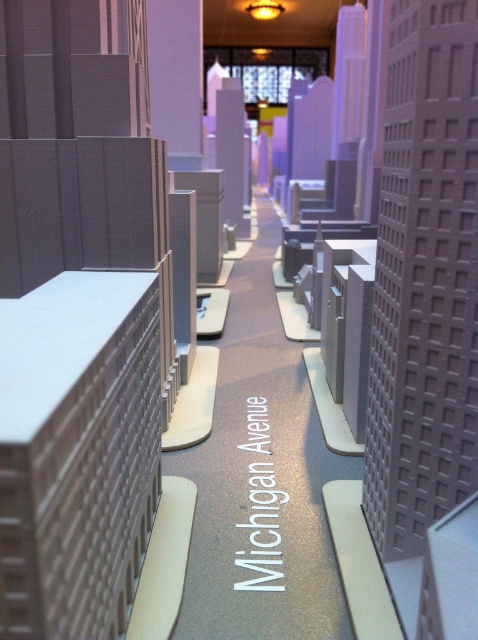
Looking at this image, can you confirm if brown textured building at center-right is bigger than matte gray pillar at center?

Indeed, brown textured building at center-right has a larger size compared to matte gray pillar at center.

Between brown textured building at center-right and matte gray pillar at center, which one appears on the left side from the viewer's perspective?

From the viewer's perspective, matte gray pillar at center appears more on the left side.

Is point (364, 486) closer to camera compared to point (176, 252)?

That is True.

The image size is (478, 640). I want to click on brown textured building at center-right, so click(x=424, y=280).

Does brown textured building at center-right have a greater width compared to purple matte building at center?

No.

Can you confirm if brown textured building at center-right is positioned below purple matte building at center?

Indeed, brown textured building at center-right is positioned under purple matte building at center.

The width and height of the screenshot is (478, 640). Describe the element at coordinates (424, 280) in the screenshot. I see `brown textured building at center-right` at that location.

Identify the location of brown textured building at center-right. 424,280.

Is point (173, 321) more distant than point (220, 106)?

That is False.

Between point (195, 212) and point (234, 202), which one is positioned in front?

Point (195, 212) is more forward.

Where is `matte gray pillar at center`? Image resolution: width=478 pixels, height=640 pixels. matte gray pillar at center is located at coordinates (183, 275).

Find the location of a particular element. matte gray pillar at center is located at coordinates [183, 275].